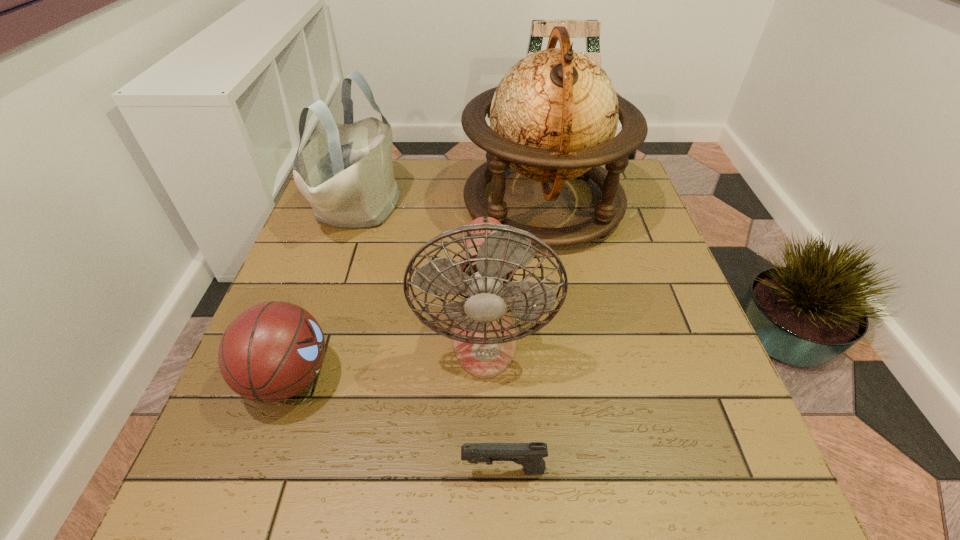
Where is `vacant region located 0.400m at the barrel of the nearest object`? vacant region located 0.400m at the barrel of the nearest object is located at coordinates (216, 470).

Image resolution: width=960 pixels, height=540 pixels. What are the coordinates of `free space located at the barrel of the nearest object` in the screenshot? It's located at (228, 470).

This screenshot has width=960, height=540. I want to click on vacant area located at the barrel of the nearest object, so click(283, 470).

The height and width of the screenshot is (540, 960). Find the location of `globe that is at the far edge`. globe that is at the far edge is located at coordinates (553, 117).

This screenshot has height=540, width=960. What are the coordinates of `shopping bag that is at the far edge` in the screenshot? It's located at (346, 172).

At what (x,y) coordinates should I click in order to perform the action: click on object that is at the near edge. Please return your answer as a coordinate pair (x, y). This screenshot has width=960, height=540. Looking at the image, I should click on (530, 455).

I want to click on shopping bag positioned at the left edge, so click(x=346, y=172).

Where is `basketball at the left edge`? This screenshot has width=960, height=540. basketball at the left edge is located at coordinates (272, 351).

The height and width of the screenshot is (540, 960). I want to click on object located at the right edge, so click(553, 117).

At what (x,y) coordinates should I click in order to perform the action: click on object that is positioned at the far left corner. Please return your answer as a coordinate pair (x, y). This screenshot has width=960, height=540. Looking at the image, I should click on (346, 172).